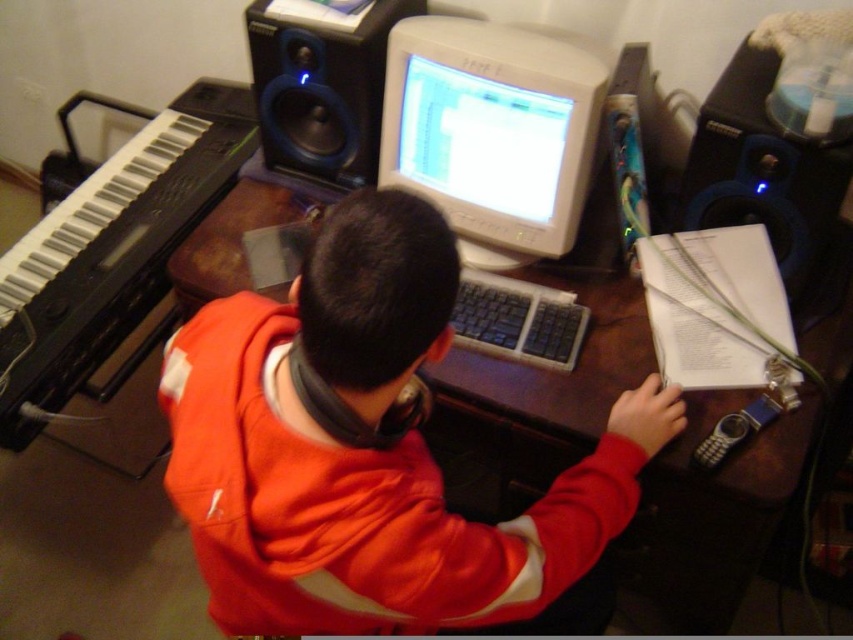
Is point (694, 208) in front of point (328, 148)?

Yes.

Based on the photo, measure the distance between point (724, 132) and camera.

They are 3.51 feet apart.

Locate an element on the screen. blue plastic speaker at right is located at coordinates (762, 170).

Between blue plastic speaker at right and black plastic keyboard at center, which one is positioned lower?

black plastic keyboard at center

Is blue plastic speaker at right behind black plastic keyboard at center?

No, blue plastic speaker at right is in front of black plastic keyboard at center.

Is point (746, 164) positioned before point (567, 353)?

Yes.

The width and height of the screenshot is (853, 640). I want to click on blue plastic speaker at right, so click(x=762, y=170).

Is orange fleece jacket at center thinner than black plastic piano at left?

No, orange fleece jacket at center is not thinner than black plastic piano at left.

Between orange fleece jacket at center and black plastic piano at left, which one has less height?

With less height is orange fleece jacket at center.

Locate an element on the screen. The height and width of the screenshot is (640, 853). orange fleece jacket at center is located at coordinates (373, 454).